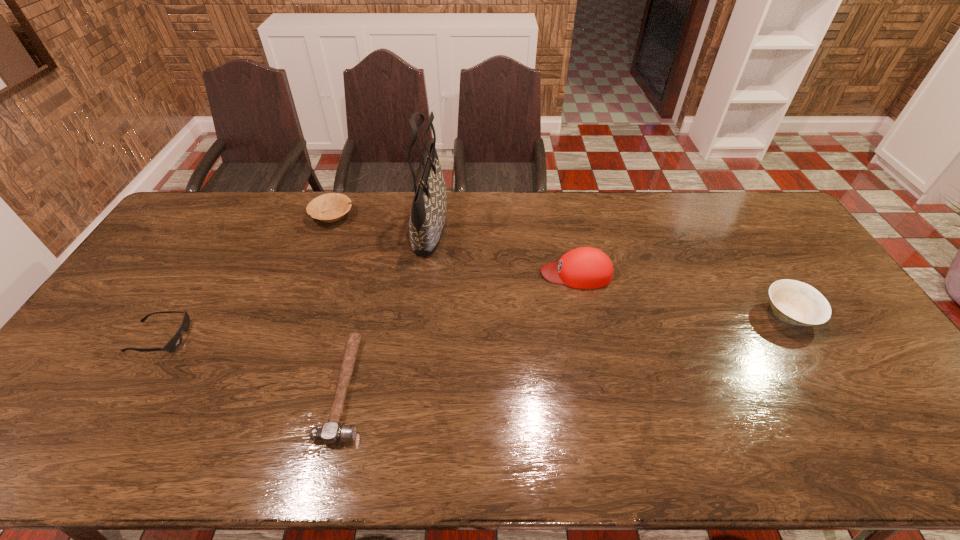
Where is `object that is at the near edge`? The image size is (960, 540). object that is at the near edge is located at coordinates (331, 433).

The width and height of the screenshot is (960, 540). Identify the location of object that is at the left edge. (175, 341).

Identify the location of object located in the right edge section of the desktop. The height and width of the screenshot is (540, 960). (794, 302).

Where is `blank space at the far edge`? blank space at the far edge is located at coordinates (489, 198).

Locate an element on the screen. This screenshot has height=540, width=960. vacant space at the near edge is located at coordinates (574, 464).

Where is `vacant space at the left edge of the desktop`? vacant space at the left edge of the desktop is located at coordinates (118, 337).

The width and height of the screenshot is (960, 540). In order to click on free space at the right edge of the desktop in this screenshot , I will do `click(801, 266)`.

This screenshot has width=960, height=540. Find the location of `vacant space at the near left corner of the desktop`. vacant space at the near left corner of the desktop is located at coordinates (64, 431).

Where is `vacant space at the far right corner of the desktop`? vacant space at the far right corner of the desktop is located at coordinates (722, 197).

Locate an element on the screen. The height and width of the screenshot is (540, 960). vacant space that is in between the left bowl and the fourth object from left to right is located at coordinates (381, 221).